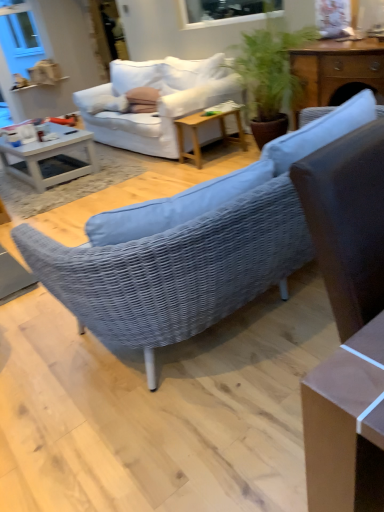
I want to click on white plastic window screen at upper center, so click(x=220, y=12).

Describe the element at coordinates (220, 12) in the screenshot. I see `white plastic window screen at upper center` at that location.

At what (x,y) coordinates should I click in order to perform the action: click on matte pink pillow at center. Please return your answer as a coordinate pair (x, y). This screenshot has width=384, height=512. Looking at the image, I should click on (143, 99).

The image size is (384, 512). What do you see at coordinates (335, 69) in the screenshot?
I see `wooden cabinet at upper right, the 1th table positioned from the front` at bounding box center [335, 69].

This screenshot has width=384, height=512. Describe the element at coordinates (50, 156) in the screenshot. I see `white glossy coffee table at left` at that location.

Find the location of a particular element. The width and height of the screenshot is (384, 512). wooden side table at center, the 1th table when ordered from left to right is located at coordinates (204, 124).

Is white plastic window screen at upper center taller or shorter than matte pink pillow at center?

Considering their sizes, white plastic window screen at upper center has more height than matte pink pillow at center.

Considering the relative positions of white plastic window screen at upper center and matte pink pillow at center in the image provided, is white plastic window screen at upper center to the left of matte pink pillow at center from the viewer's perspective?

No.

Which is nearer, (212, 16) or (143, 101)?

Point (212, 16) is positioned closer to the camera compared to point (143, 101).

In order to click on window screen above the matte pink pillow at center (from the image's perspective) in this screenshot , I will do `click(220, 12)`.

How many degrees apart are the facing directions of woven fabric studio couch at center, which is counted as the second studio couch, starting from the right, and white fabric studio couch at upper center, which ranks as the second studio couch in left-to-right order?

The facing directions of woven fabric studio couch at center, which is counted as the second studio couch, starting from the right, and white fabric studio couch at upper center, which ranks as the second studio couch in left-to-right order, are 180 degrees apart.

Is woven fabric studio couch at center, which is counted as the second studio couch, starting from the right, facing away from white fabric studio couch at upper center, which ranks as the second studio couch in left-to-right order?

No, woven fabric studio couch at center, which is counted as the second studio couch, starting from the right, is not facing the opposite direction of white fabric studio couch at upper center, which ranks as the second studio couch in left-to-right order.

Where is `studio couch behind the woven fabric studio couch at center, the first studio couch in the left-to-right sequence`? studio couch behind the woven fabric studio couch at center, the first studio couch in the left-to-right sequence is located at coordinates (158, 102).

In terms of width, does woven fabric studio couch at center, which is counted as the second studio couch, starting from the right, look wider or thinner when compared to white fabric studio couch at upper center, the first studio couch viewed from the right?

woven fabric studio couch at center, which is counted as the second studio couch, starting from the right, is wider than white fabric studio couch at upper center, the first studio couch viewed from the right.

How much distance is there between white glossy coffee table at left and woven fabric studio couch at center, the first studio couch in the left-to-right sequence?

white glossy coffee table at left is 2.80 meters from woven fabric studio couch at center, the first studio couch in the left-to-right sequence.

Based on the photo, does white glossy coffee table at left come in front of woven fabric studio couch at center, which is counted as the second studio couch, starting from the right?

No, white glossy coffee table at left is further to the viewer.

Between point (89, 163) and point (278, 168), which one is positioned in front?

Positioned in front is point (278, 168).

From a real-world perspective, does white glossy coffee table at left stand above woven fabric studio couch at center, the first studio couch in the left-to-right sequence?

Indeed, from a real-world perspective, white glossy coffee table at left stands above woven fabric studio couch at center, the first studio couch in the left-to-right sequence.

From the picture: From the image's perspective, which one is positioned lower, white fabric studio couch at upper center, which ranks as the second studio couch in left-to-right order, or wooden cabinet at upper right, which ranks as the second table in left-to-right order?

wooden cabinet at upper right, which ranks as the second table in left-to-right order, from the image's perspective.

From a real-world perspective, is white fabric studio couch at upper center, the first studio couch viewed from the right, over wooden cabinet at upper right, the second table from the back?

Actually, white fabric studio couch at upper center, the first studio couch viewed from the right, is physically below wooden cabinet at upper right, the second table from the back, in the real world.

This screenshot has width=384, height=512. I want to click on the 2nd table counting from the right of the white fabric studio couch at upper center, the first studio couch viewed from the right, so click(335, 69).

From the picture: Can you confirm if white fabric studio couch at upper center, which ranks as the second studio couch in left-to-right order, is taller than wooden cabinet at upper right, the first table positioned from the right?

Indeed, white fabric studio couch at upper center, which ranks as the second studio couch in left-to-right order, has a greater height compared to wooden cabinet at upper right, the first table positioned from the right.

Considering the relative sizes of wooden cabinet at upper right, the 1th table positioned from the front, and white fabric studio couch at upper center, the first studio couch viewed from the right, in the image provided, is wooden cabinet at upper right, the 1th table positioned from the front, thinner than white fabric studio couch at upper center, the first studio couch viewed from the right,?

Yes.

Is wooden cabinet at upper right, the 1th table positioned from the front, in front of or behind white fabric studio couch at upper center, which ranks as the second studio couch in left-to-right order, in the image?

wooden cabinet at upper right, the 1th table positioned from the front, is in front of white fabric studio couch at upper center, which ranks as the second studio couch in left-to-right order.

From a real-world perspective, is wooden cabinet at upper right, the second table from the back, below white fabric studio couch at upper center, which ranks as the second studio couch in left-to-right order?

Actually, wooden cabinet at upper right, the second table from the back, is physically above white fabric studio couch at upper center, which ranks as the second studio couch in left-to-right order, in the real world.

Which object is positioned more to the right, white plastic window screen at upper center or wooden cabinet at upper right, the 1th table positioned from the front?

wooden cabinet at upper right, the 1th table positioned from the front.

From the image's perspective, is white plastic window screen at upper center over wooden cabinet at upper right, which ranks as the second table in left-to-right order?

Yes, from the image's perspective, white plastic window screen at upper center is above wooden cabinet at upper right, which ranks as the second table in left-to-right order.

How many degrees apart are the facing directions of white plastic window screen at upper center and wooden cabinet at upper right, the second table from the back?

The facing directions of white plastic window screen at upper center and wooden cabinet at upper right, the second table from the back, are 0.00037 degrees apart.

Which of these two, wooden side table at center, the 1th table when ordered from left to right, or matte pink pillow at center, stands taller?

With more height is wooden side table at center, the 1th table when ordered from left to right.

Looking at this image, is wooden side table at center, which is the second table from right to left, facing towards matte pink pillow at center?

No, wooden side table at center, which is the second table from right to left, is not aimed at matte pink pillow at center.

Where is `pillow behind the wooden side table at center, which is counted as the 2th table, starting from the front`? This screenshot has width=384, height=512. pillow behind the wooden side table at center, which is counted as the 2th table, starting from the front is located at coordinates (143, 99).

Consider the image. From the image's perspective, which one is positioned higher, wooden side table at center, marked as the first table in a back-to-front arrangement, or matte pink pillow at center?

From the image's view, matte pink pillow at center is above.

Locate an element on the screen. pillow behind the white plastic window screen at upper center is located at coordinates (143, 99).

Identify the location of studio couch above the woven fabric studio couch at center, the first studio couch in the left-to-right sequence (from the image's perspective). click(x=158, y=102).

Estimate the real-world distances between objects in this image. Which object is further from white fabric studio couch at upper center, which ranks as the second studio couch in left-to-right order, white glossy coffee table at left or wooden side table at center, marked as the first table in a back-to-front arrangement?

white glossy coffee table at left is further to white fabric studio couch at upper center, which ranks as the second studio couch in left-to-right order.

Based on their spatial positions, is matte pink pillow at center or wooden cabinet at upper right, the 1th table positioned from the front, further from white plastic window screen at upper center?

wooden cabinet at upper right, the 1th table positioned from the front.

From the image, which object appears to be farther from wooden cabinet at upper right, the first table positioned from the right, white plastic window screen at upper center or white glossy coffee table at left?

white glossy coffee table at left.

Looking at this image, estimate the real-world distances between objects in this image. Which object is closer to white fabric studio couch at upper center, which ranks as the second studio couch in left-to-right order, wooden cabinet at upper right, the second table from the back, or woven fabric studio couch at center, the first studio couch in the left-to-right sequence?

The object closer to white fabric studio couch at upper center, which ranks as the second studio couch in left-to-right order, is wooden cabinet at upper right, the second table from the back.

Which object lies nearer to the anchor point white glossy coffee table at left, wooden side table at center, which is the second table from right to left, or wooden cabinet at upper right, the 1th table positioned from the front?

The object closer to white glossy coffee table at left is wooden side table at center, which is the second table from right to left.

When comparing their distances from white glossy coffee table at left, does white fabric studio couch at upper center, which ranks as the second studio couch in left-to-right order, or matte pink pillow at center seem closer?

white fabric studio couch at upper center, which ranks as the second studio couch in left-to-right order, is closer to white glossy coffee table at left.

Which object lies nearer to the anchor point white glossy coffee table at left, white plastic window screen at upper center or wooden side table at center, which is counted as the 2th table, starting from the front?

wooden side table at center, which is counted as the 2th table, starting from the front, lies closer to white glossy coffee table at left than the other object.

Which object lies further to the anchor point wooden cabinet at upper right, the 1th table positioned from the front, matte pink pillow at center or wooden side table at center, which is the second table from right to left?

Among the two, matte pink pillow at center is located further to wooden cabinet at upper right, the 1th table positioned from the front.

Find the location of `studio couch between woven fabric studio couch at center, the first studio couch in the left-to-right sequence, and matte pink pillow at center in the front-back direction`. studio couch between woven fabric studio couch at center, the first studio couch in the left-to-right sequence, and matte pink pillow at center in the front-back direction is located at coordinates (158, 102).

Identify the location of pillow between white plastic window screen at upper center and wooden side table at center, the 1th table when ordered from left to right, from top to bottom. The width and height of the screenshot is (384, 512). (143, 99).

At what (x,y) coordinates should I click in order to perform the action: click on pillow situated between white glossy coffee table at left and wooden cabinet at upper right, the second table from the back, from left to right. Please return your answer as a coordinate pair (x, y). The image size is (384, 512). Looking at the image, I should click on (143, 99).

You are a GUI agent. You are given a task and a screenshot of the screen. Output one action in this format:
    pyautogui.click(x=<x>, y=<y>)
    Task: Click on the window screen between white fabric studio couch at upper center, which ranks as the second studio couch in left-to-right order, and wooden cabinet at upper right, the 1th table positioned from the front, from left to right
    The width and height of the screenshot is (384, 512).
    Given the screenshot: What is the action you would take?
    pyautogui.click(x=220, y=12)